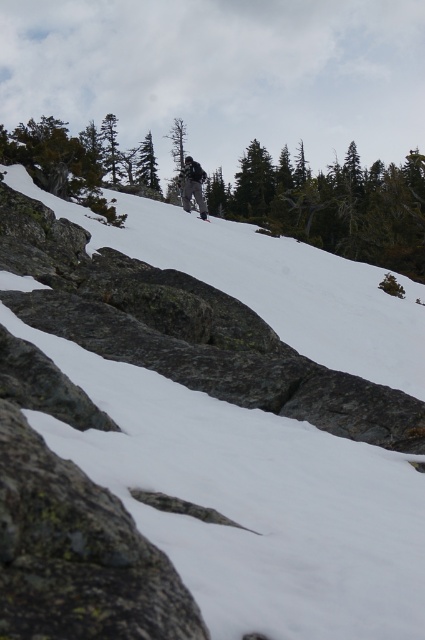
Is point (192, 173) positioned after point (204, 216)?

No, it is in front of (204, 216).

Find the location of `dark gray ski pants at center`. dark gray ski pants at center is located at coordinates (192, 184).

You are a GUI agent. You are given a task and a screenshot of the screen. Output one action in this format:
    pyautogui.click(x=<x>, y=<y>)
    Task: Click on the dark gray ski pants at center
    
    Given the screenshot: What is the action you would take?
    pyautogui.click(x=192, y=184)

Which of these two, green matte tree at center or black matte ski at center, stands shorter?

Standing shorter between the two is black matte ski at center.

Based on the photo, between green matte tree at center and black matte ski at center, which one appears on the right side from the viewer's perspective?

black matte ski at center

Is point (150, 141) in front of point (209, 220)?

No, it is behind (209, 220).

Locate an element on the screen. green matte tree at center is located at coordinates (147, 164).

Is green leafy tree at upper center closer to camera compared to black matte ski at center?

Yes, it is.

Who is shorter, green leafy tree at upper center or black matte ski at center?

black matte ski at center is shorter.

Does point (108, 120) come behind point (204, 220)?

Yes.

At what (x,y) coordinates should I click in order to perform the action: click on green leafy tree at upper center. Please return your answer as a coordinate pair (x, y). Image resolution: width=425 pixels, height=640 pixels. Looking at the image, I should click on (331, 204).